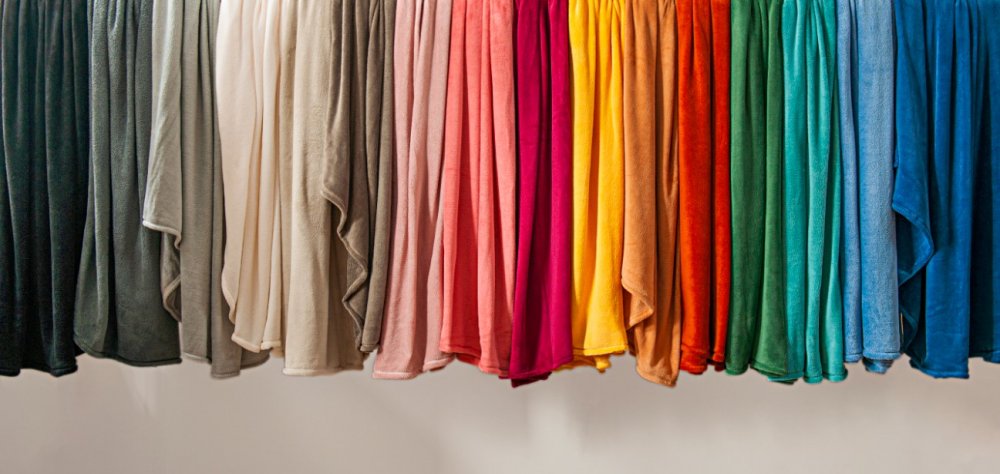
I want to click on primary coloured towels, so click(956, 256), click(764, 243), click(713, 211), click(601, 218).